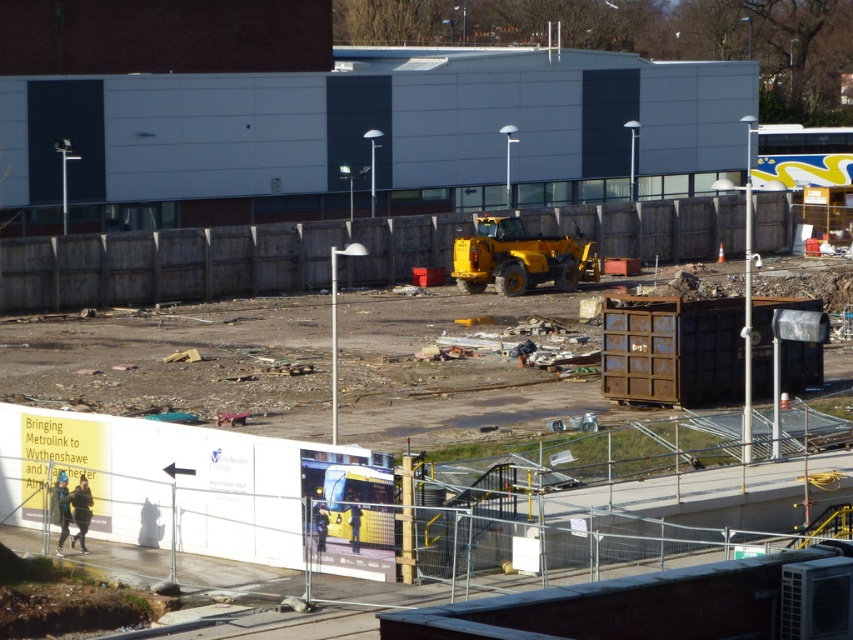
Question: Which of the following is the farthest from the observer?

Choices:
 (A) yellow rubber tire at center
 (B) yellow rubber tractor at center

Answer: (B)

Question: Is yellow rubber tire at center positioned before yellow rubber tractor at center?

Choices:
 (A) no
 (B) yes

Answer: (B)

Question: Is yellow rubber tire at center to the left of yellow rubber tractor at center from the viewer's perspective?

Choices:
 (A) yes
 (B) no

Answer: (B)

Question: Is yellow rubber tire at center wider than yellow rubber tractor at center?

Choices:
 (A) yes
 (B) no

Answer: (A)